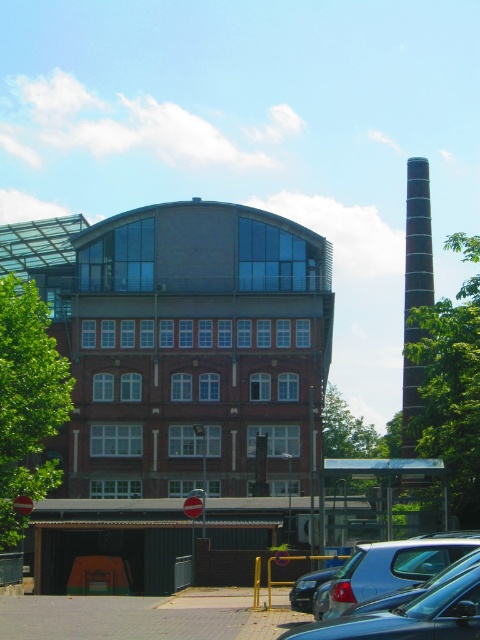
You are a delivery driver approaching the brown brick building at center and the metallic silver car at center. Based on your observation, which object is closer to you?

The brown brick building at center is closer to you because the metallic silver car at center is behind it.

You are a photographer planning to capture the brown brick building at center and the metallic silver car at center in a single frame. Considering their sizes, which object should you position closer to the camera to ensure both are visible clearly in the photo?

The brown brick building at center is bigger than the metallic silver car at center, so to ensure both are visible clearly in the photo, you should position the metallic silver car at center closer to the camera. This way, the smaller car can be enlarged in the frame while keeping the larger building at a distance for proper scaling.